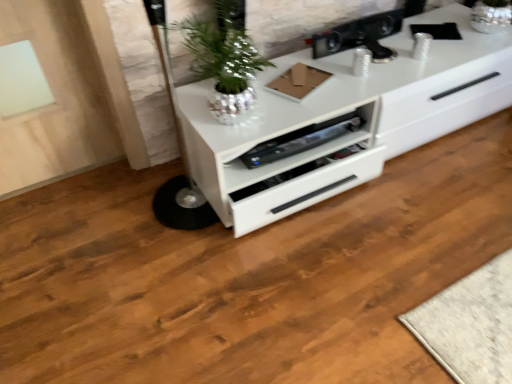
Question: Is white glossy chest of drawers at center at the back of shiny metallic plant at center?

Choices:
 (A) no
 (B) yes

Answer: (A)

Question: Considering the relative sizes of shiny metallic plant at center and white glossy chest of drawers at center in the image provided, is shiny metallic plant at center thinner than white glossy chest of drawers at center?

Choices:
 (A) yes
 (B) no

Answer: (A)

Question: Is shiny metallic plant at center smaller than white glossy chest of drawers at center?

Choices:
 (A) no
 (B) yes

Answer: (B)

Question: Is shiny metallic plant at center not near white glossy chest of drawers at center?

Choices:
 (A) yes
 (B) no

Answer: (B)

Question: From the image's perspective, would you say shiny metallic plant at center is shown under white glossy chest of drawers at center?

Choices:
 (A) yes
 (B) no

Answer: (B)

Question: Considering the relative sizes of shiny metallic plant at center and white glossy chest of drawers at center in the image provided, is shiny metallic plant at center wider than white glossy chest of drawers at center?

Choices:
 (A) yes
 (B) no

Answer: (B)

Question: From the image's perspective, is white glossy chest of drawers at center under shiny metallic plant at center?

Choices:
 (A) yes
 (B) no

Answer: (A)

Question: Does white glossy chest of drawers at center contain shiny metallic plant at center?

Choices:
 (A) yes
 (B) no

Answer: (B)

Question: Can you confirm if white glossy chest of drawers at center is positioned to the right of shiny metallic plant at center?

Choices:
 (A) yes
 (B) no

Answer: (A)

Question: Does white glossy chest of drawers at center turn towards shiny metallic plant at center?

Choices:
 (A) yes
 (B) no

Answer: (B)

Question: Can you confirm if white glossy chest of drawers at center is shorter than shiny metallic plant at center?

Choices:
 (A) no
 (B) yes

Answer: (B)

Question: Does white glossy chest of drawers at center have a larger size compared to shiny metallic plant at center?

Choices:
 (A) no
 (B) yes

Answer: (B)

Question: Is shiny metallic plant at center wider than metallic black speaker at upper center, the second appliance when ordered from bottom to top?

Choices:
 (A) yes
 (B) no

Answer: (A)